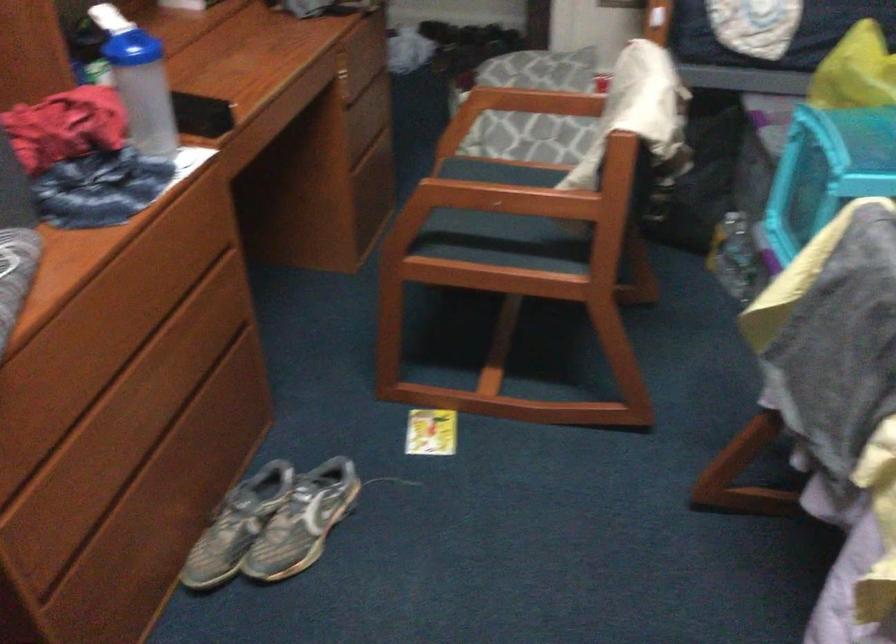
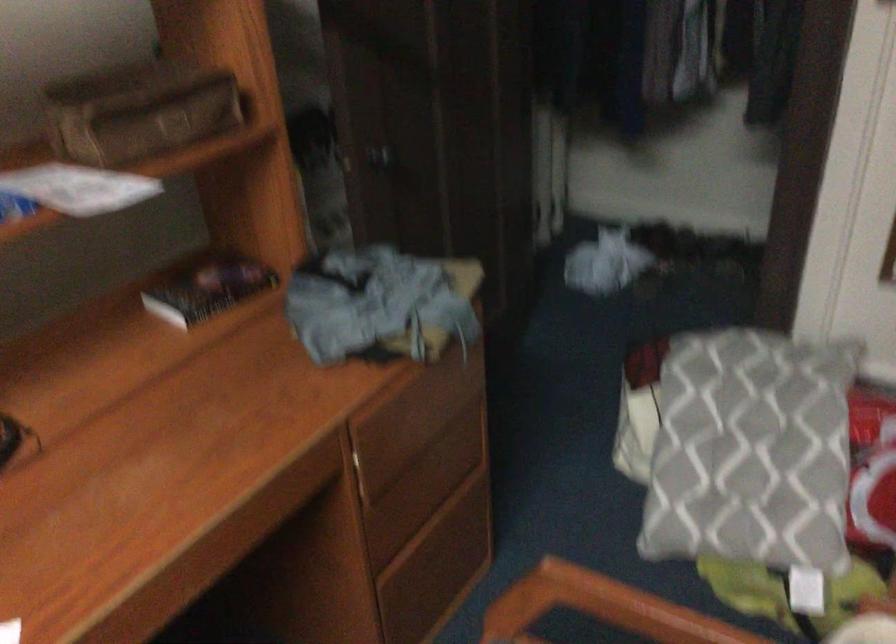
Question: What movement of the cameraman would produce the second image?

Choices:
 (A) Left
 (B) Right
 (C) Forward
 (D) Backward

Answer: (C)